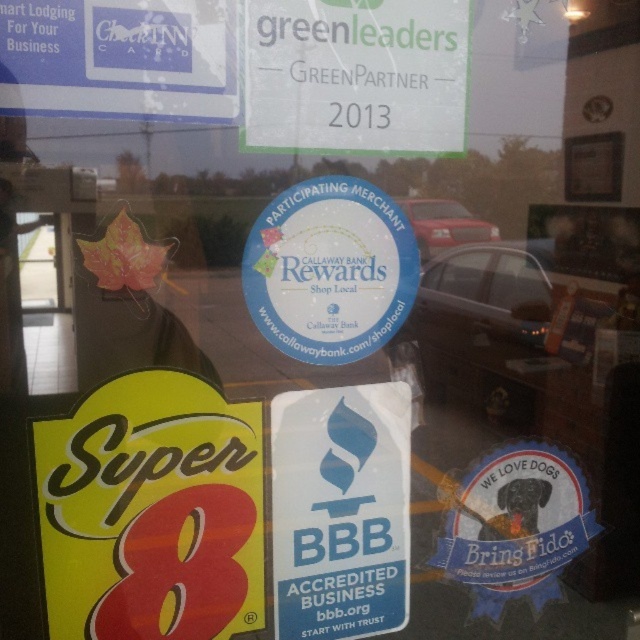
You are standing 5 feet away from the glass window. There is a point at coordinates point (250, 44) on the window. Can you reach this point without moving closer to the window?

The distance of point (250, 44) from viewer is 4.23 feet. Since you are standing 5 feet away from the window, the point is farther away from you than your current position. Therefore, you cannot reach it without moving closer.

You are a customer standing in front of the glass window. You see the yellow matte sign at lower left and the white paper sign at upper left. Which sign is closer to you?

The yellow matte sign at lower left is closer to you because the white paper sign at upper left is behind it.